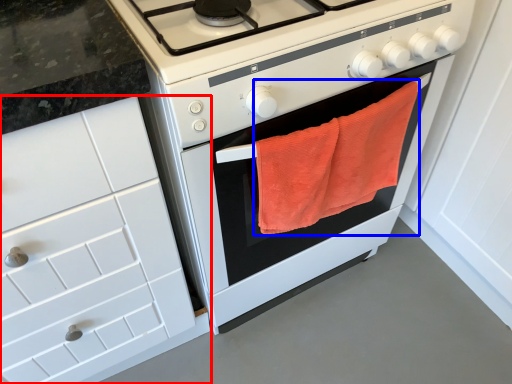
Question: Among these objects, which one is nearest to the camera, cabinetry (highlighted by a red box) or beach towel (highlighted by a blue box)?

Choices:
 (A) cabinetry
 (B) beach towel

Answer: (A)